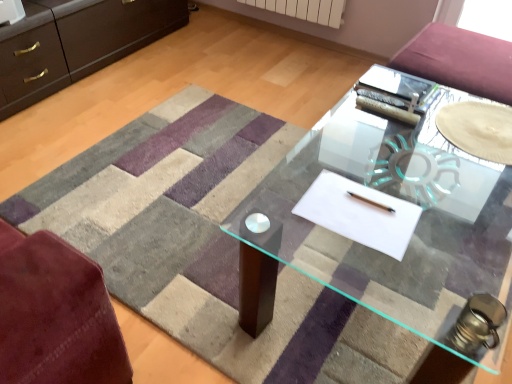
Question: From the image's perspective, does white paper at center appear lower than transparent glass plate at center?

Choices:
 (A) yes
 (B) no

Answer: (A)

Question: Is white paper at center oriented towards transparent glass plate at center?

Choices:
 (A) no
 (B) yes

Answer: (A)

Question: Considering the relative positions of white paper at center and transparent glass plate at center in the image provided, is white paper at center in front of transparent glass plate at center?

Choices:
 (A) yes
 (B) no

Answer: (A)

Question: Does white paper at center have a greater width compared to transparent glass plate at center?

Choices:
 (A) yes
 (B) no

Answer: (B)

Question: Can you confirm if white paper at center is taller than transparent glass plate at center?

Choices:
 (A) no
 (B) yes

Answer: (A)

Question: Is white paper at center at the right side of transparent glass plate at center?

Choices:
 (A) no
 (B) yes

Answer: (A)

Question: Can you confirm if transparent glass table at center is smaller than white paper at center?

Choices:
 (A) no
 (B) yes

Answer: (A)

Question: Can you confirm if transparent glass table at center is positioned to the left of white paper at center?

Choices:
 (A) no
 (B) yes

Answer: (B)

Question: Is transparent glass table at center not close to white paper at center?

Choices:
 (A) no
 (B) yes

Answer: (A)

Question: From the image's perspective, would you say transparent glass table at center is shown under white paper at center?

Choices:
 (A) no
 (B) yes

Answer: (B)

Question: Does transparent glass table at center come behind white paper at center?

Choices:
 (A) yes
 (B) no

Answer: (A)

Question: Is transparent glass table at center shorter than white paper at center?

Choices:
 (A) no
 (B) yes

Answer: (A)

Question: Considering the relative positions of transparent glass plate at center and transparent glass table at center in the image provided, is transparent glass plate at center to the right of transparent glass table at center from the viewer's perspective?

Choices:
 (A) yes
 (B) no

Answer: (A)